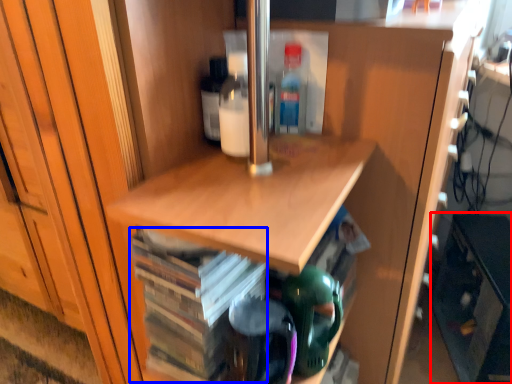
Question: Which of the following is the closest to the observer, cabinetry (highlighted by a red box) or book (highlighted by a blue box)?

Choices:
 (A) cabinetry
 (B) book

Answer: (B)